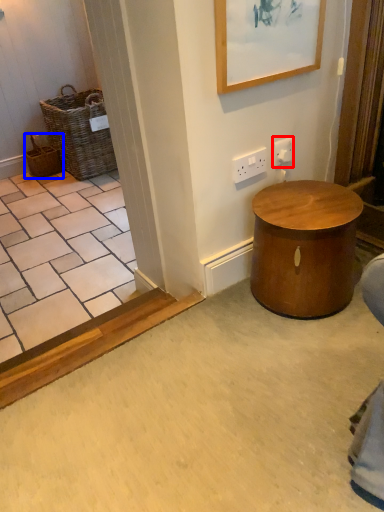
Question: Which object is closer to the camera taking this photo, electric outlet (highlighted by a red box) or basket (highlighted by a blue box)?

Choices:
 (A) electric outlet
 (B) basket

Answer: (A)